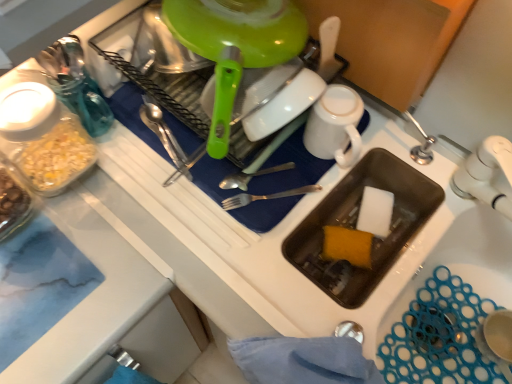
This screenshot has height=384, width=512. I want to click on yellow sponge at sink bottom, marked as the 1th food in a left-to-right arrangement, so click(x=347, y=246).

The height and width of the screenshot is (384, 512). Describe the element at coordinates (347, 246) in the screenshot. I see `yellow sponge at sink bottom, marked as the 1th food in a left-to-right arrangement` at that location.

This screenshot has width=512, height=384. In order to click on silver metallic fork at center in this screenshot , I will do `click(265, 197)`.

This screenshot has width=512, height=384. I want to click on shiny metal spoon at center, so click(162, 131).

Is white matte mug at upper center positioned behind silver metallic fork at center?

That is False.

Is silver metallic fork at center at the back of white matte mug at upper center?

No, white matte mug at upper center's orientation is not away from silver metallic fork at center.

Based on the photo, which of these two, white matte mug at upper center or silver metallic fork at center, is bigger?

white matte mug at upper center.

Between white sponge at sink bottom, arranged as the first food when viewed from the right, and white matte mug at upper center, which one has larger size?

white matte mug at upper center.

From a real-world perspective, is white sponge at sink bottom, the 2th food viewed from the left, positioned under white matte mug at upper center based on gravity?

Answer: Yes, from a real-world perspective, white sponge at sink bottom, the 2th food viewed from the left, is beneath white matte mug at upper center.

Choose the correct answer: Is white sponge at sink bottom, the 2th food viewed from the left, inside white matte mug at upper center or outside it?

white sponge at sink bottom, the 2th food viewed from the left, is outside white matte mug at upper center.

Is silver metallic fork at center positioned with its back to shiny metal spoon at center?

No, silver metallic fork at center's orientation is not away from shiny metal spoon at center.

Does silver metallic fork at center have a greater width compared to shiny metal spoon at center?

Yes.

Is silver metallic fork at center inside or outside of shiny metal spoon at center?

The correct answer is: outside.

Is silver metallic fork at center positioned with its back to white matte mug at upper center?

Yes, silver metallic fork at center's orientation is away from white matte mug at upper center.

From a real-world perspective, is silver metallic fork at center physically located above or below white matte mug at upper center?

silver metallic fork at center is below white matte mug at upper center.

Is silver metallic fork at center far away from white matte mug at upper center?

No.

Between silver metallic fork at center and white matte mug at upper center, which one has less height?

Standing shorter between the two is silver metallic fork at center.

Which is nearer, [180,159] or [384,197]?

Clearly, point [180,159] is closer to the camera than point [384,197].

Is shiny metal spoon at center with white sponge at sink bottom, the 2th food viewed from the left?

No, shiny metal spoon at center is not next to white sponge at sink bottom, the 2th food viewed from the left.

Is point (170, 109) farther from viewer compared to point (382, 210)?

No, (170, 109) is in front of (382, 210).

Is green plastic kettle at upper center at the right side of white sponge at sink bottom, arranged as the first food when viewed from the right?

No.

Is green plastic kettle at upper center bigger than white sponge at sink bottom, the 2th food viewed from the left?

Yes.

Does green plastic kettle at upper center have a greater width compared to white sponge at sink bottom, the 2th food viewed from the left?

Yes.

From the image's perspective, which is above, white sponge at sink bottom, arranged as the first food when viewed from the right, or yellow sponge at sink bottom, which appears as the 2th food when viewed from the right?

white sponge at sink bottom, arranged as the first food when viewed from the right, from the image's perspective.

Measure the distance between white sponge at sink bottom, the 2th food viewed from the left, and yellow sponge at sink bottom, marked as the 1th food in a left-to-right arrangement.

They are 2.68 inches apart.

Would you say yellow sponge at sink bottom, which appears as the 2th food when viewed from the right, is part of white sponge at sink bottom, the 2th food viewed from the left,'s contents?

That's incorrect, yellow sponge at sink bottom, which appears as the 2th food when viewed from the right, is not inside white sponge at sink bottom, the 2th food viewed from the left.

Considering the positions of objects white sponge at sink bottom, arranged as the first food when viewed from the right, and yellow sponge at sink bottom, marked as the 1th food in a left-to-right arrangement, in the image provided, who is in front, white sponge at sink bottom, arranged as the first food when viewed from the right, or yellow sponge at sink bottom, marked as the 1th food in a left-to-right arrangement,?

yellow sponge at sink bottom, marked as the 1th food in a left-to-right arrangement, is more forward.

I want to click on tableware on the right side of silver metallic fork at center, so click(335, 126).

From a real-world perspective, starting from the white matte mug at upper center, which food is the 2nd one below it? Please provide its 2D coordinates.

[(375, 212)]

Consider the image. Based on their spatial positions, is white matte mug at upper center or shiny metal spoon at center closer to white sponge at sink bottom, arranged as the first food when viewed from the right?

Among the two, white matte mug at upper center is located nearer to white sponge at sink bottom, arranged as the first food when viewed from the right.

From the image, which object appears to be farther from white sponge at sink bottom, arranged as the first food when viewed from the right, yellow sponge at sink bottom, which appears as the 2th food when viewed from the right, or shiny metal spoon at center?

Among the two, shiny metal spoon at center is located further to white sponge at sink bottom, arranged as the first food when viewed from the right.

Considering their positions, is white matte mug at upper center positioned further to green plastic kettle at upper center than shiny metal spoon at center?

Among the two, white matte mug at upper center is located further to green plastic kettle at upper center.

Which object lies nearer to the anchor point yellow sponge at sink bottom, marked as the 1th food in a left-to-right arrangement, white matte mug at upper center or white sponge at sink bottom, the 2th food viewed from the left?

white sponge at sink bottom, the 2th food viewed from the left, is closer to yellow sponge at sink bottom, marked as the 1th food in a left-to-right arrangement.

Considering their positions, is white matte mug at upper center positioned closer to green plastic kettle at upper center than silver metallic fork at center?

Based on the image, white matte mug at upper center appears to be nearer to green plastic kettle at upper center.

Consider the image. Based on their spatial positions, is white sponge at sink bottom, the 2th food viewed from the left, or yellow sponge at sink bottom, which appears as the 2th food when viewed from the right, further from white matte mug at upper center?

yellow sponge at sink bottom, which appears as the 2th food when viewed from the right, is positioned further to the anchor white matte mug at upper center.

Which object lies nearer to the anchor point shiny metal spoon at center, green plastic kettle at upper center or white matte mug at upper center?

Among the two, green plastic kettle at upper center is located nearer to shiny metal spoon at center.

From the image, which object appears to be farther from white matte mug at upper center, shiny metal spoon at center or white sponge at sink bottom, arranged as the first food when viewed from the right?

shiny metal spoon at center.

Identify the location of appliance between shiny metal spoon at center and white sponge at sink bottom, arranged as the first food when viewed from the right, in the horizontal direction. (262, 114).

Where is `food between shiny metal spoon at center and white sponge at sink bottom, arranged as the first food when viewed from the right`? This screenshot has width=512, height=384. food between shiny metal spoon at center and white sponge at sink bottom, arranged as the first food when viewed from the right is located at coordinates (347, 246).

You are a GUI agent. You are given a task and a screenshot of the screen. Output one action in this format:
    pyautogui.click(x=<x>, y=<y>)
    Task: Click on the appliance between shiny metal spoon at center and silver metallic fork at center
    The width and height of the screenshot is (512, 384).
    Given the screenshot: What is the action you would take?
    pyautogui.click(x=262, y=114)

Locate an element on the screen. This screenshot has height=384, width=512. tableware between green plastic kettle at upper center and yellow sponge at sink bottom, marked as the 1th food in a left-to-right arrangement, in the vertical direction is located at coordinates (335, 126).